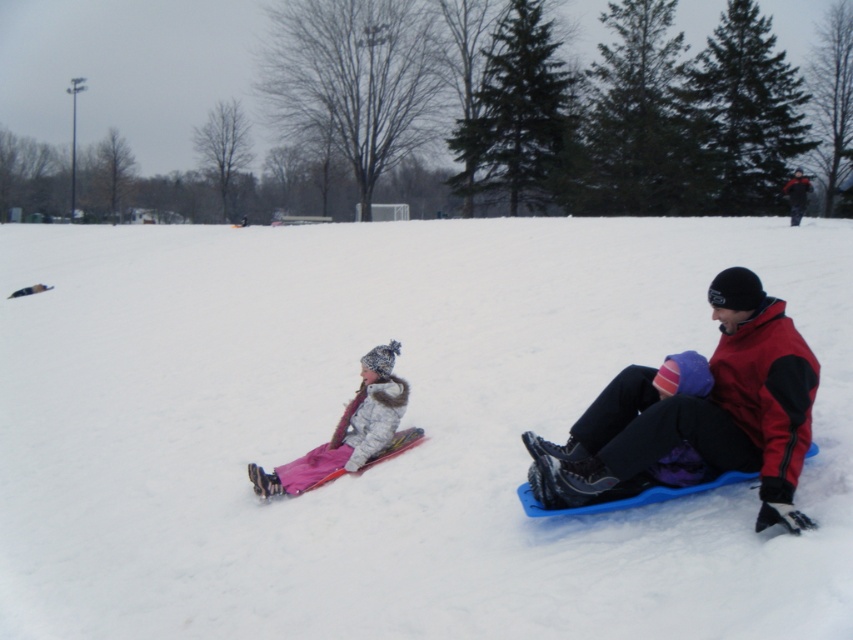
Question: Does white fluffy snow at center appear on the left side of pink fleece snowsuit at left?

Choices:
 (A) no
 (B) yes

Answer: (B)

Question: Based on their relative distances, which object is farther from the red fleece jacket at lower right?

Choices:
 (A) white fluffy snow at center
 (B) pink fleece snowsuit at left

Answer: (A)

Question: Does red fleece jacket at lower right lie behind pink fleece snowsuit at left?

Choices:
 (A) yes
 (B) no

Answer: (B)

Question: Which point is farther to the camera?

Choices:
 (A) (323, 472)
 (B) (618, 417)

Answer: (A)

Question: Which point is farther to the camera?

Choices:
 (A) pink fleece snowsuit at left
 (B) white fluffy snow at center

Answer: (A)

Question: Does red fleece jacket at lower right appear over pink fleece snowsuit at left?

Choices:
 (A) no
 (B) yes

Answer: (B)